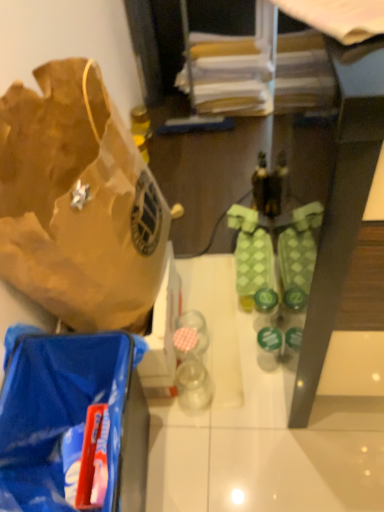
Measure the distance between green textured socks at center and camera.

The distance of green textured socks at center from camera is 4.01 feet.

The height and width of the screenshot is (512, 384). Describe the element at coordinates (78, 202) in the screenshot. I see `brown paper bag at left` at that location.

The image size is (384, 512). What do you see at coordinates (58, 409) in the screenshot?
I see `blue plastic bag at lower left` at bounding box center [58, 409].

Where is `green matte bottle at center`? Image resolution: width=384 pixels, height=512 pixels. green matte bottle at center is located at coordinates (269, 347).

Image resolution: width=384 pixels, height=512 pixels. I want to click on bottle beneath the brown paper bag at left (from a real-world perspective), so click(x=269, y=347).

In the scene shown: Between green matte bottle at center and brown paper bag at left, which one appears on the right side from the viewer's perspective?

green matte bottle at center is more to the right.

Measure the distance from green matte bottle at center to brown paper bag at left.

They are 59.27 centimeters apart.

In the scene shown: From a real-world perspective, which is physically below, green matte bottle at center or blue plastic bag at lower left?

green matte bottle at center.

Does green matte bottle at center have a larger size compared to blue plastic bag at lower left?

No.

Can you confirm if green matte bottle at center is positioned to the left of blue plastic bag at lower left?

No, green matte bottle at center is not to the left of blue plastic bag at lower left.

Is green matte bottle at center in front of or behind blue plastic bag at lower left in the image?

green matte bottle at center is positioned farther from the viewer than blue plastic bag at lower left.

The height and width of the screenshot is (512, 384). In order to click on footwear below the brown paper bag at left (from the image's perspective) in this screenshot , I will do `click(251, 254)`.

Can you confirm if green textured socks at center is taller than brown paper bag at left?

No, green textured socks at center is not taller than brown paper bag at left.

Which is closer, (265, 254) or (136, 149)?

Point (265, 254).

Who is bigger, blue plastic bag at lower left or green textured socks at center?

Bigger between the two is blue plastic bag at lower left.

Is blue plastic bag at lower left far from green textured socks at center?

blue plastic bag at lower left is actually quite close to green textured socks at center.

I want to click on luggage and bags on the left of green textured socks at center, so click(x=58, y=409).

In the scene shown: Is blue plastic bag at lower left to the right of green matte bottle at center from the viewer's perspective?

No.

Who is shorter, blue plastic bag at lower left or green matte bottle at center?

green matte bottle at center is shorter.

Image resolution: width=384 pixels, height=512 pixels. Find the location of `luggage and bags on the left of green matte bottle at center`. luggage and bags on the left of green matte bottle at center is located at coordinates (58, 409).

Is blue plastic bag at lower left beside green matte bottle at center?

No, blue plastic bag at lower left is not beside green matte bottle at center.

Looking at this image, from the image's perspective, which one is positioned higher, green matte bottle at center or green textured socks at center?

green textured socks at center is shown above in the image.

Where is `bottle in front of the green textured socks at center`? This screenshot has height=512, width=384. bottle in front of the green textured socks at center is located at coordinates (269, 347).

Is green matte bottle at center inside the boundaries of green textured socks at center, or outside?

green matte bottle at center is not inside green textured socks at center, it's outside.

Is green matte bottle at center positioned far away from green textured socks at center?

They are positioned close to each other.

Between blue plastic bag at lower left and brown paper bag at left, which one has larger size?

With larger size is brown paper bag at left.

Which of these two, blue plastic bag at lower left or brown paper bag at left, stands shorter?

blue plastic bag at lower left is shorter.

Would you say brown paper bag at left is part of blue plastic bag at lower left's contents?

No, brown paper bag at left is not inside blue plastic bag at lower left.

Is blue plastic bag at lower left aimed at brown paper bag at left?

No, blue plastic bag at lower left is not turned towards brown paper bag at left.

Identify the location of bottle on the right side of brown paper bag at left. This screenshot has height=512, width=384. (269, 347).

This screenshot has height=512, width=384. In order to click on bottle behind the blue plastic bag at lower left in this screenshot , I will do `click(269, 347)`.

Looking at the image, which one is located closer to green textured socks at center, green matte bottle at center or brown paper bag at left?

green matte bottle at center is positioned closer to the anchor green textured socks at center.

Which object lies further to the anchor point blue plastic bag at lower left, brown paper bag at left or green matte bottle at center?

green matte bottle at center is positioned further to the anchor blue plastic bag at lower left.

Which object lies further to the anchor point green matte bottle at center, blue plastic bag at lower left or brown paper bag at left?

brown paper bag at left is positioned further to the anchor green matte bottle at center.

From the image, which object appears to be farther from green textured socks at center, green matte bottle at center or blue plastic bag at lower left?

blue plastic bag at lower left is further to green textured socks at center.

Looking at the image, which one is located closer to brown paper bag at left, green textured socks at center or blue plastic bag at lower left?

blue plastic bag at lower left is closer to brown paper bag at left.

Looking at the image, which one is located closer to brown paper bag at left, green matte bottle at center or blue plastic bag at lower left?

blue plastic bag at lower left.

When comparing their distances from green textured socks at center, does brown paper bag at left or green matte bottle at center seem further?

brown paper bag at left lies further to green textured socks at center than the other object.

When comparing their distances from green matte bottle at center, does green textured socks at center or blue plastic bag at lower left seem further?

blue plastic bag at lower left.

The height and width of the screenshot is (512, 384). I want to click on luggage and bags between brown paper bag at left and green textured socks at center in the front-back direction, so click(x=58, y=409).

This screenshot has height=512, width=384. Find the location of `luggage and bags between brown paper bag at left and green matte bottle at center in the front-back direction`. luggage and bags between brown paper bag at left and green matte bottle at center in the front-back direction is located at coordinates (58, 409).

Identify the location of bottle located between brown paper bag at left and green textured socks at center in the depth direction. Image resolution: width=384 pixels, height=512 pixels. (269, 347).

The height and width of the screenshot is (512, 384). What are the coordinates of `bottle positioned between blue plastic bag at lower left and green textured socks at center from near to far` in the screenshot? It's located at (x=269, y=347).